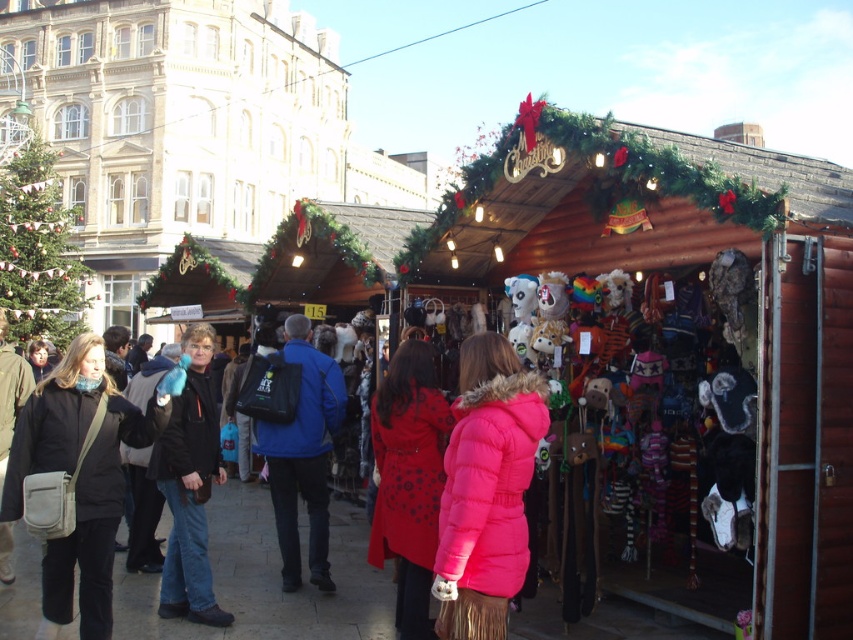
Measure the distance between pink puffy coat at center and camera.

pink puffy coat at center is 67.60 feet from camera.

Locate an element on the screen. The width and height of the screenshot is (853, 640). pink puffy coat at center is located at coordinates (486, 490).

Who is more distant from viewer, (469,380) or (265,458)?

Positioned behind is point (265,458).

Locate an element on the screen. This screenshot has width=853, height=640. pink puffy coat at center is located at coordinates (486, 490).

Between black fabric jacket at center and matte black jacket at left, which one has more height?

black fabric jacket at center

Is black fabric jacket at center in front of matte black jacket at left?

Yes, black fabric jacket at center is closer to the viewer.

Where is `black fabric jacket at center`? This screenshot has width=853, height=640. black fabric jacket at center is located at coordinates (189, 486).

Between pink puffy coat at center and black fabric jacket at center, which one appears on the left side from the viewer's perspective?

black fabric jacket at center is more to the left.

Can you confirm if pink puffy coat at center is positioned to the right of black fabric jacket at center?

Indeed, pink puffy coat at center is positioned on the right side of black fabric jacket at center.

You are a GUI agent. You are given a task and a screenshot of the screen. Output one action in this format:
    pyautogui.click(x=<x>, y=<y>)
    Task: Click on the pink puffy coat at center
    Image resolution: width=853 pixels, height=640 pixels.
    Given the screenshot: What is the action you would take?
    pyautogui.click(x=486, y=490)